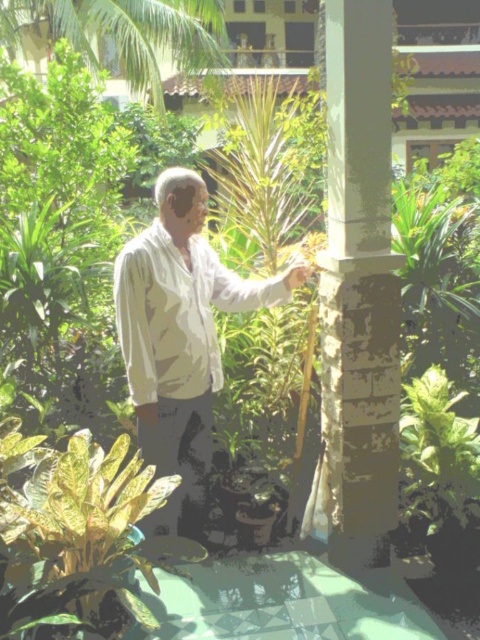
You are a visitor in the garden and want to take a photo of the white textured pillar at center and the green leafy palm tree at upper left. Which object should you focus on first to ensure both are in the frame?

You should focus on the white textured pillar at center first since it is closer to you than the green leafy palm tree at upper left, ensuring both are in the frame.

You are a photographer trying to capture a shot of the white matte shirt at center and the green leafy palm tree at upper left. Based on their positions, which object is located to the right of the other?

The white matte shirt at center is positioned on the right side of green leafy palm tree at upper left.